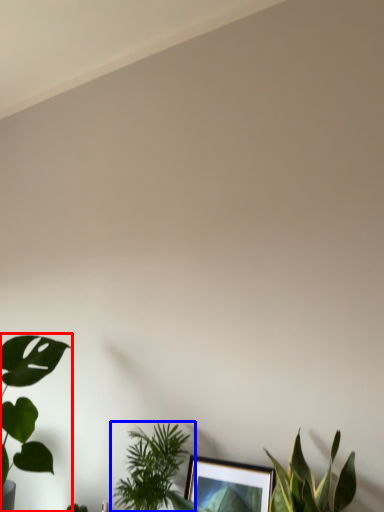
Question: Which of the following is the farthest to the observer, houseplant (highlighted by a red box) or houseplant (highlighted by a blue box)?

Choices:
 (A) houseplant
 (B) houseplant

Answer: (B)